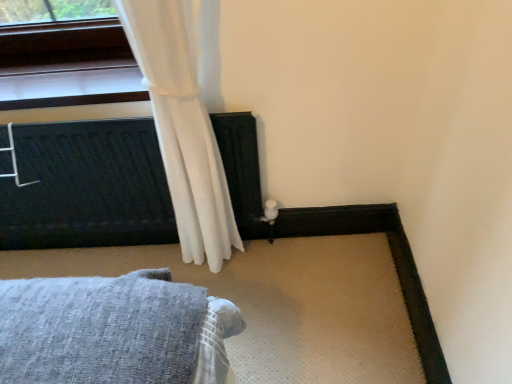
What do you see at coordinates (87, 187) in the screenshot? I see `textured gray blanket at lower left` at bounding box center [87, 187].

Where is `textured gray blanket at lower left`? This screenshot has height=384, width=512. textured gray blanket at lower left is located at coordinates (87, 187).

Where is `textured gray blanket at lower left`? The image size is (512, 384). textured gray blanket at lower left is located at coordinates (87, 187).